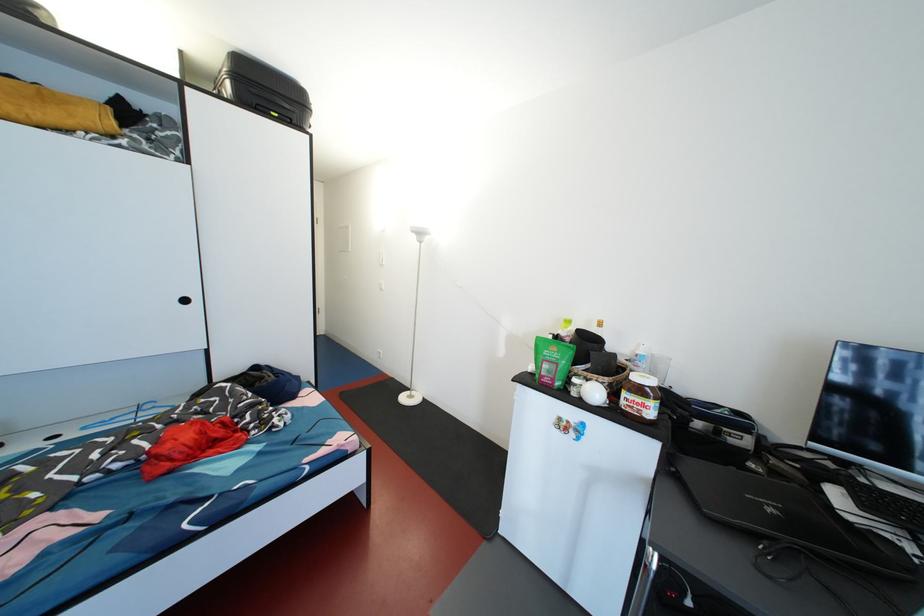
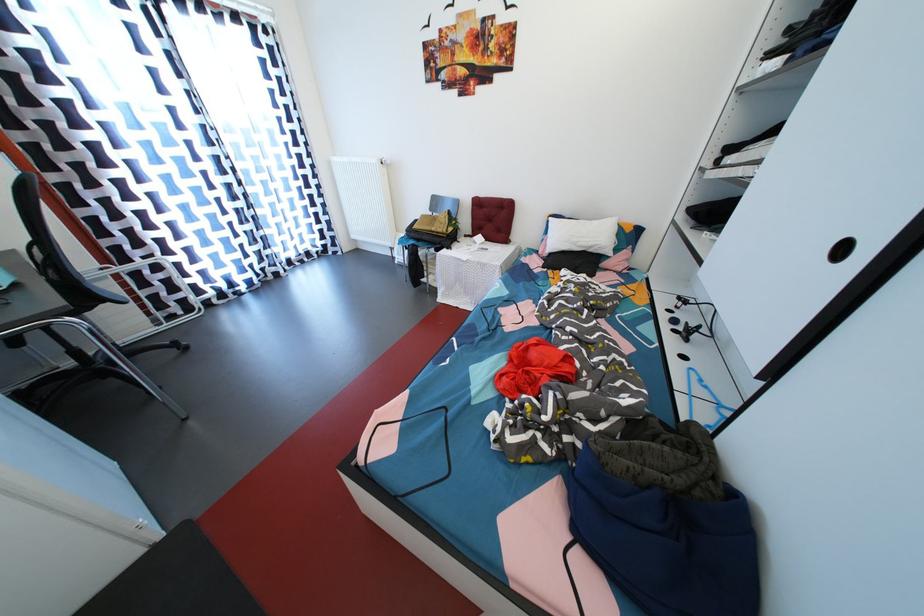
Find the pixel in the second image that matches point (191, 306) in the first image.

(848, 254)